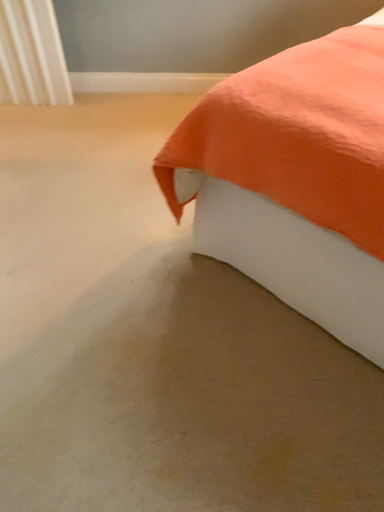
Find the location of `orange fabric bed at upper right`. orange fabric bed at upper right is located at coordinates (295, 179).

The image size is (384, 512). Describe the element at coordinates (295, 179) in the screenshot. I see `orange fabric bed at upper right` at that location.

In order to face orange fabric bed at upper right, should I rotate leftwards or rightwards?

It's best to rotate right around 26.556 degrees.

Where is `orange fabric bed at upper right`? orange fabric bed at upper right is located at coordinates (295, 179).